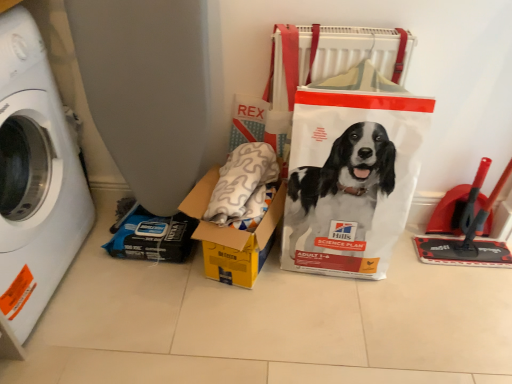
Find the location of `vacant space that is to the left of yellow cardboard box at center`. vacant space that is to the left of yellow cardboard box at center is located at coordinates (146, 283).